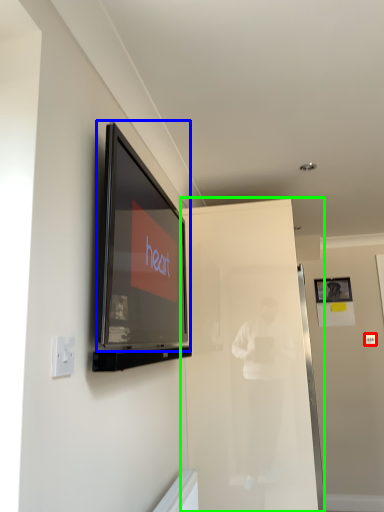
Question: Estimate the real-world distances between objects in this image. Which object is farther from light switch (highlighted by a red box), television (highlighted by a blue box) or glass door (highlighted by a green box)?

Choices:
 (A) television
 (B) glass door

Answer: (A)